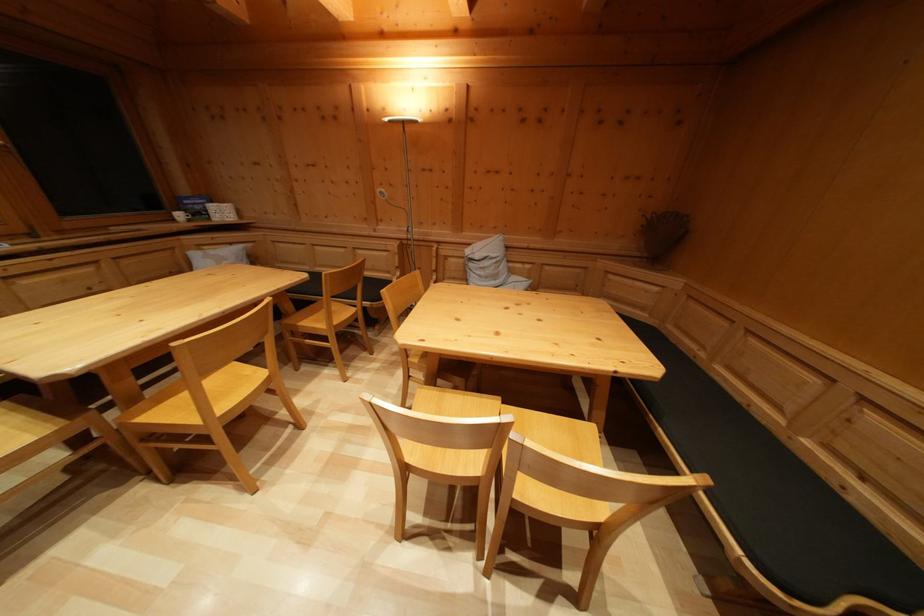
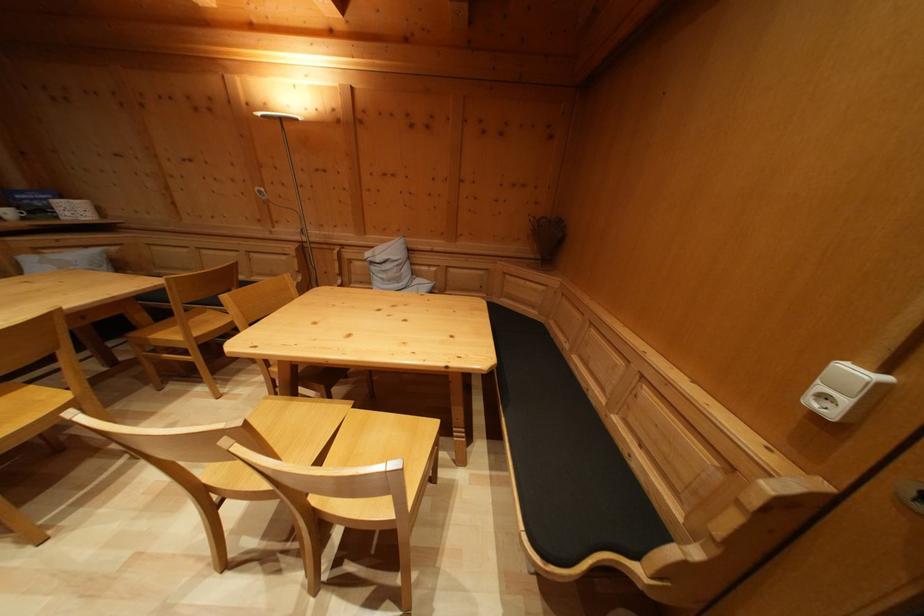
The point at (663, 432) is marked in the first image. Where is the corresponding point in the second image?

(507, 422)